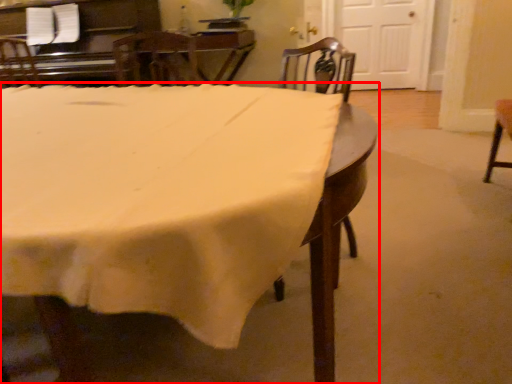
Question: From the image's perspective, what is the correct spatial relationship of table (annotated by the red box) in relation to chair?

Choices:
 (A) below
 (B) above

Answer: (A)